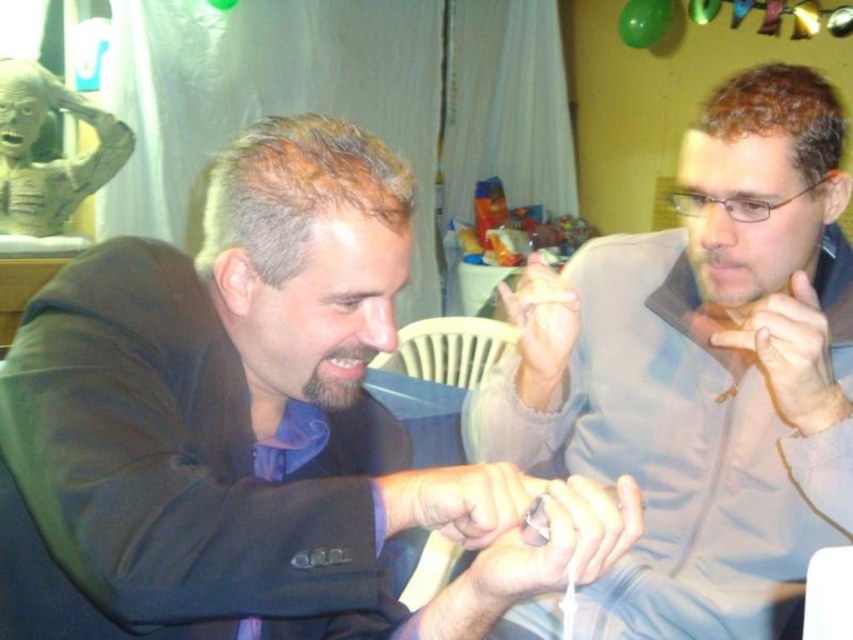
Can you confirm if matte black jacket at left is positioned to the left of light brown leather jacket at right?

Correct, you'll find matte black jacket at left to the left of light brown leather jacket at right.

Is matte black jacket at left shorter than light brown leather jacket at right?

Yes.

Find the location of a particular element. The width and height of the screenshot is (853, 640). matte black jacket at left is located at coordinates (254, 429).